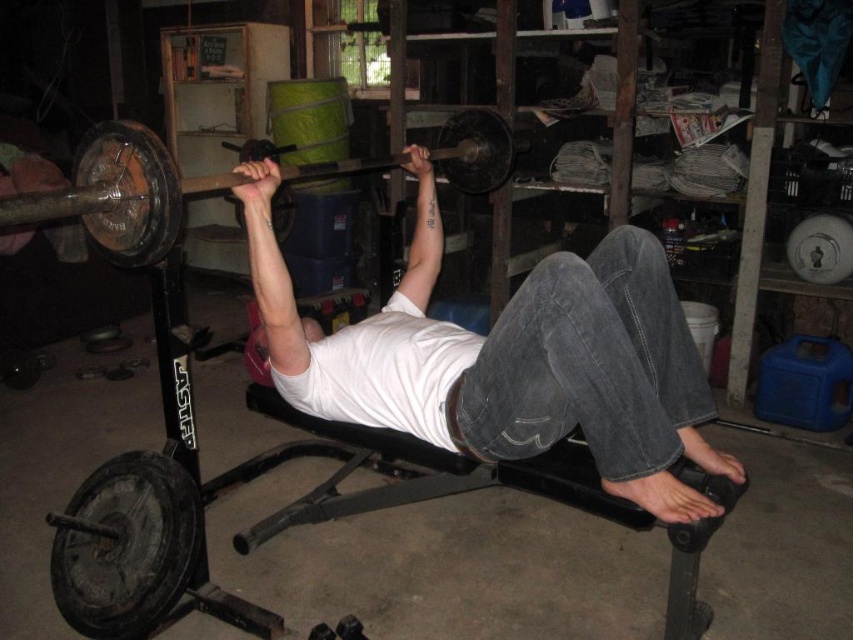
Does white matte shirt at center appear on the left side of rusty metal barbell at center?

No, white matte shirt at center is not to the left of rusty metal barbell at center.

Can you confirm if white matte shirt at center is bigger than rusty metal barbell at center?

Correct, white matte shirt at center is larger in size than rusty metal barbell at center.

Is point (579, 296) farther from viewer compared to point (177, 193)?

That is True.

Identify the location of white matte shirt at center. (508, 356).